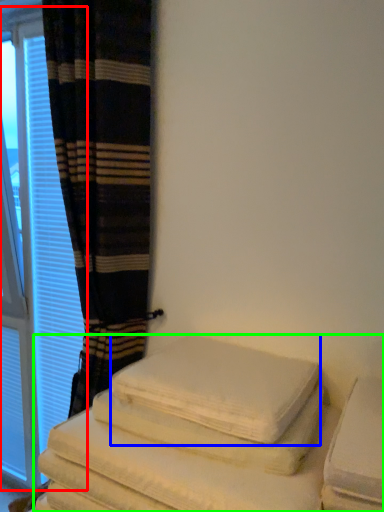
Question: Considering the real-world distances, which object is farthest from window (highlighted by a red box)? bath towel (highlighted by a blue box) or furniture (highlighted by a green box)?

Choices:
 (A) bath towel
 (B) furniture

Answer: (B)